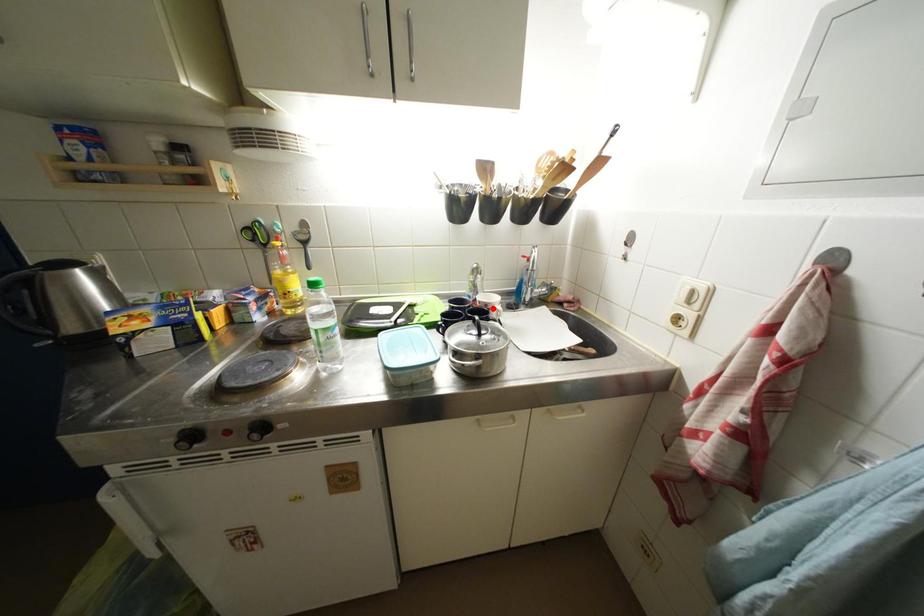
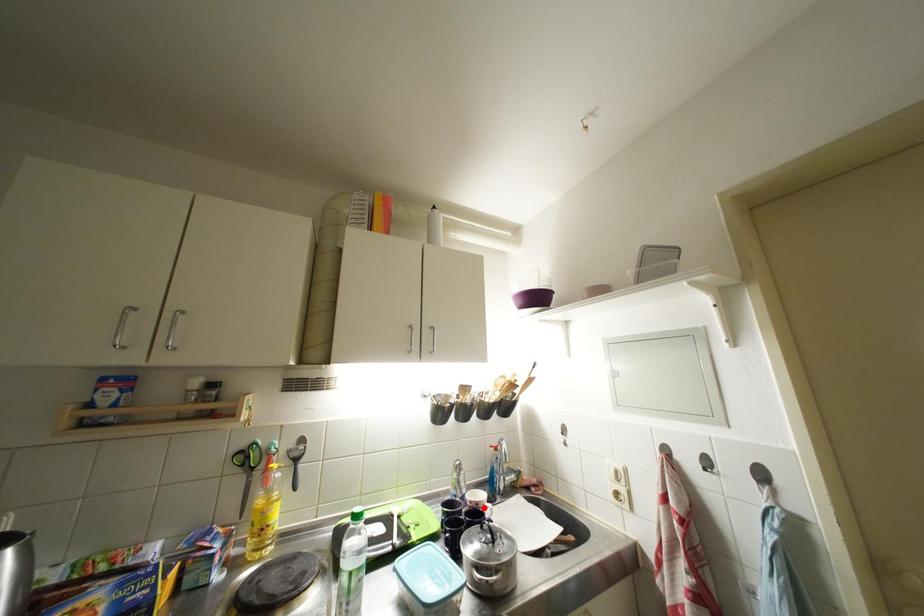
I am providing you with two images of the same scene from different viewpoints. A red point is marked on the first image and another point is marked on the second image. Are the points marked in image1 and image2 representing the same 3D position?

Yes